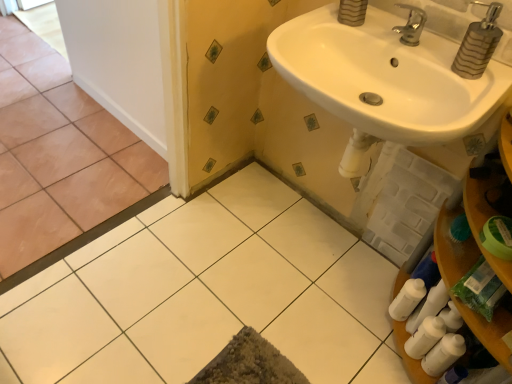
You are a GUI agent. You are given a task and a screenshot of the screen. Output one action in this format:
    pyautogui.click(x=<x>, y=<y>)
    Task: Click on the free space above brown matte tile at left, which appears as the 1th ceramic tile when viewed from the left (from a real-world perspective)
    The image size is (512, 384).
    Given the screenshot: What is the action you would take?
    (44, 128)